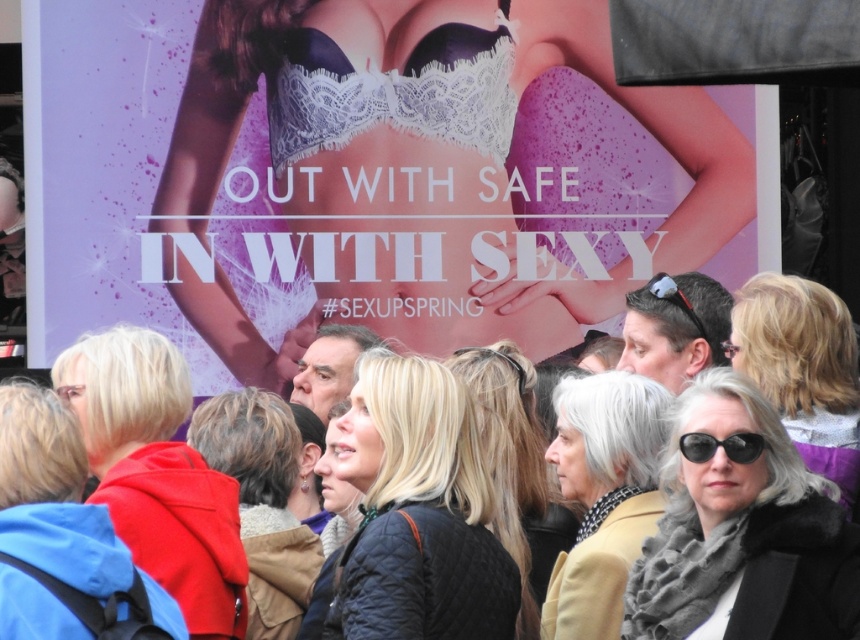
Is quilted black jacket at center wider than black plastic sunglasses at center?

Correct, the width of quilted black jacket at center exceeds that of black plastic sunglasses at center.

Is quilted black jacket at center below black plastic sunglasses at center?

Indeed, quilted black jacket at center is positioned under black plastic sunglasses at center.

Locate an element on the screen. This screenshot has width=860, height=640. quilted black jacket at center is located at coordinates (418, 513).

Does matte black sunglasses at center have a greater width compared to white lace corset at upper center?

In fact, matte black sunglasses at center might be narrower than white lace corset at upper center.

Who is more distant from viewer, (751, 506) or (269, 80)?

Point (269, 80)

At what (x,y) coordinates should I click in order to perform the action: click on matte black sunglasses at center. Please return your answer as a coordinate pair (x, y). The height and width of the screenshot is (640, 860). Looking at the image, I should click on click(742, 529).

Is point (564, 582) positioned in front of point (753, 451)?

That is False.

Does gray wool scarf at center come behind black plastic sunglasses at center?

Yes, gray wool scarf at center is behind black plastic sunglasses at center.

The width and height of the screenshot is (860, 640). I want to click on gray wool scarf at center, so click(x=603, y=496).